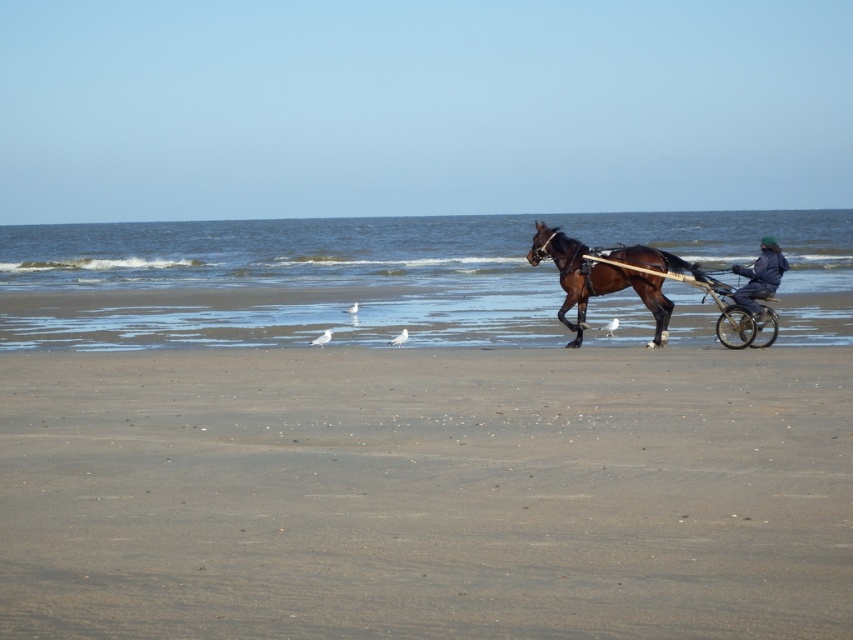
Question: Is smooth sand beach at center smaller than dark blue fabric jacket at center?

Choices:
 (A) no
 (B) yes

Answer: (A)

Question: Which point is farther to the camera?

Choices:
 (A) (614, 262)
 (B) (285, 620)
 (C) (776, 260)

Answer: (A)

Question: Which of the following is the farthest from the observer?

Choices:
 (A) dark blue fabric jacket at center
 (B) wooden cart at center
 (C) smooth sand beach at center
 (D) brown glossy horse at center

Answer: (D)

Question: Is smooth sand beach at center positioned at the back of brown glossy horse at center?

Choices:
 (A) yes
 (B) no

Answer: (B)

Question: Which object is closer to the camera taking this photo?

Choices:
 (A) smooth sand beach at center
 (B) wooden cart at center
 (C) dark blue fabric jacket at center

Answer: (A)

Question: Considering the relative positions of smooth sand beach at center and brown glossy horse at center in the image provided, where is smooth sand beach at center located with respect to brown glossy horse at center?

Choices:
 (A) right
 (B) left

Answer: (B)